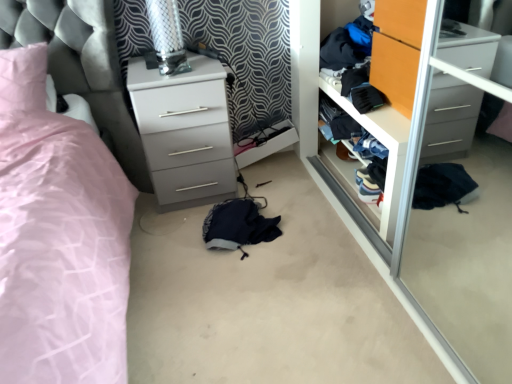
This screenshot has width=512, height=384. I want to click on vacant space in front of white glossy chest of drawers at center, so click(165, 240).